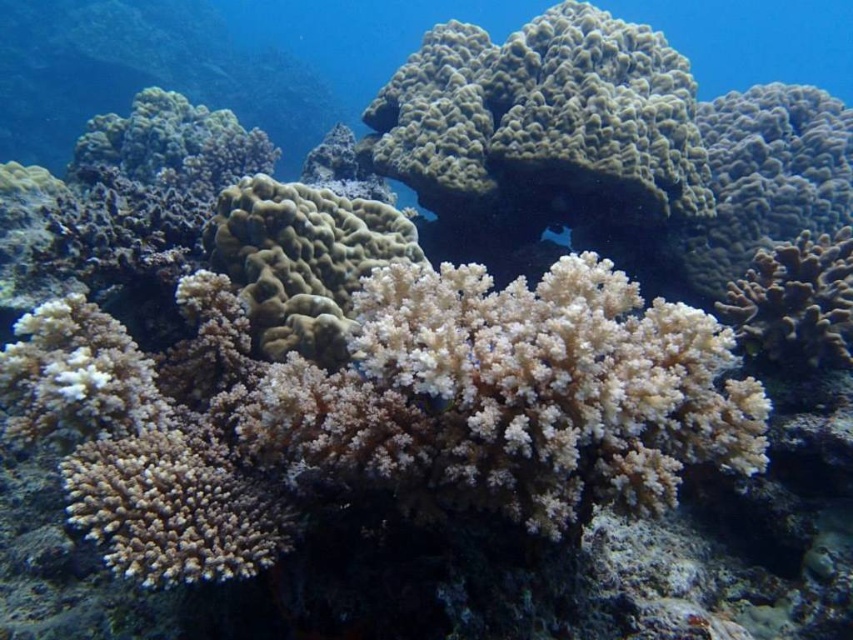
Question: Is white soft coral at center behind white soft coral at right?

Choices:
 (A) no
 (B) yes

Answer: (A)

Question: Does white soft coral at center lie behind white soft coral at right?

Choices:
 (A) no
 (B) yes

Answer: (A)

Question: Which object is closer to the camera taking this photo?

Choices:
 (A) white soft coral at right
 (B) white soft coral at center

Answer: (B)

Question: Which object is closer to the camera taking this photo?

Choices:
 (A) white soft coral at center
 (B) white soft coral at right

Answer: (A)

Question: Can you confirm if white soft coral at center is positioned below white soft coral at right?

Choices:
 (A) yes
 (B) no

Answer: (B)